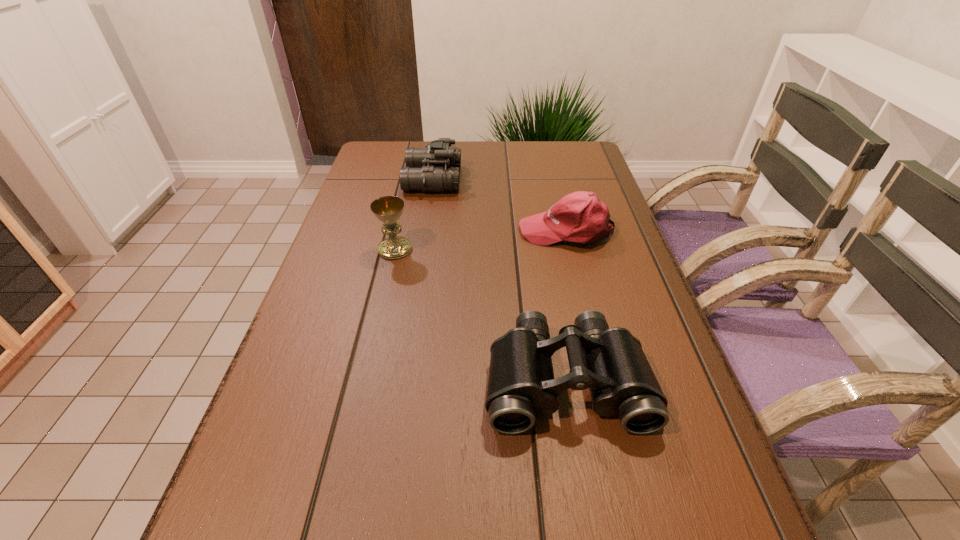
The width and height of the screenshot is (960, 540). I want to click on vacant space at the right edge of the desktop, so click(x=666, y=346).

The height and width of the screenshot is (540, 960). In the image, there is a desktop. Find the location of `vacant space at the far left corner`. vacant space at the far left corner is located at coordinates (366, 152).

The height and width of the screenshot is (540, 960). What are the coordinates of `free space at the far right corner of the desktop` in the screenshot? It's located at (564, 161).

The image size is (960, 540). In order to click on vacant area that lies between the left binoculars and the baseball cap in this screenshot , I will do `click(499, 205)`.

Where is `vacant space that's between the baseball cap and the chalice`? This screenshot has width=960, height=540. vacant space that's between the baseball cap and the chalice is located at coordinates (481, 240).

Where is `unoccupied position between the baseball cap and the left binoculars`? This screenshot has height=540, width=960. unoccupied position between the baseball cap and the left binoculars is located at coordinates click(499, 205).

I want to click on free space between the nearer binoculars and the farther binoculars, so click(499, 279).

Locate an element on the screen. The height and width of the screenshot is (540, 960). free space that is in between the farther binoculars and the baseball cap is located at coordinates (499, 205).

Identify the location of vacant space in between the left binoculars and the right binoculars. pyautogui.click(x=499, y=279).

At what (x,y) coordinates should I click in order to perform the action: click on vacant area between the baseball cap and the farther binoculars. Please return your answer as a coordinate pair (x, y). The height and width of the screenshot is (540, 960). Looking at the image, I should click on (499, 205).